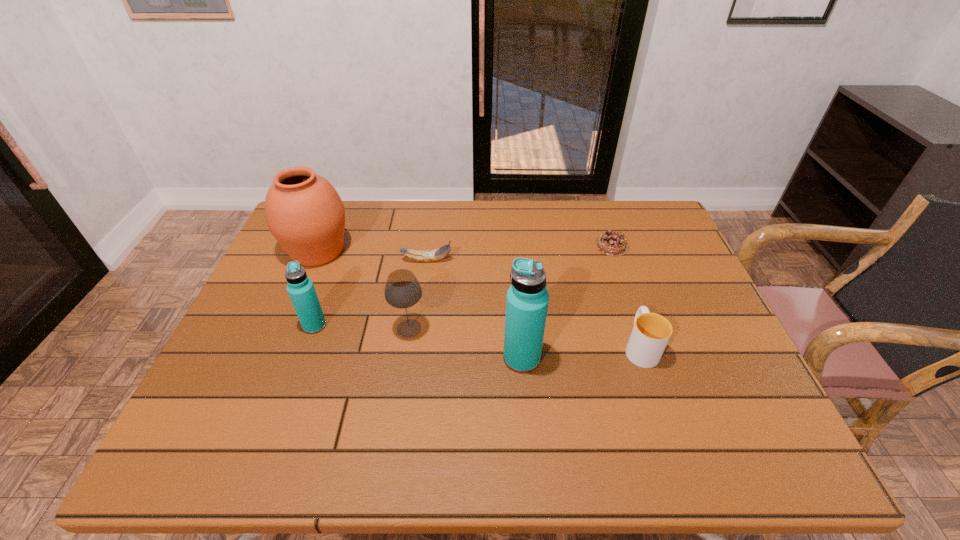
Locate an element on the screen. The image size is (960, 540). vacant space that satisfies the following two spatial constraints: 1. at the stem of the banana; 2. on the right side of the right water bottle is located at coordinates (414, 358).

Where is `free spot that satisfies the following two spatial constraints: 1. on the front side of the sixth shortest object; 2. on the left side of the taller water bottle`? The image size is (960, 540). free spot that satisfies the following two spatial constraints: 1. on the front side of the sixth shortest object; 2. on the left side of the taller water bottle is located at coordinates (273, 358).

The width and height of the screenshot is (960, 540). Find the location of `vacant area in the image that satisfies the following two spatial constraints: 1. with the handle on the side of the chocolate cake; 2. on the right side of the cup`. vacant area in the image that satisfies the following two spatial constraints: 1. with the handle on the side of the chocolate cake; 2. on the right side of the cup is located at coordinates (607, 246).